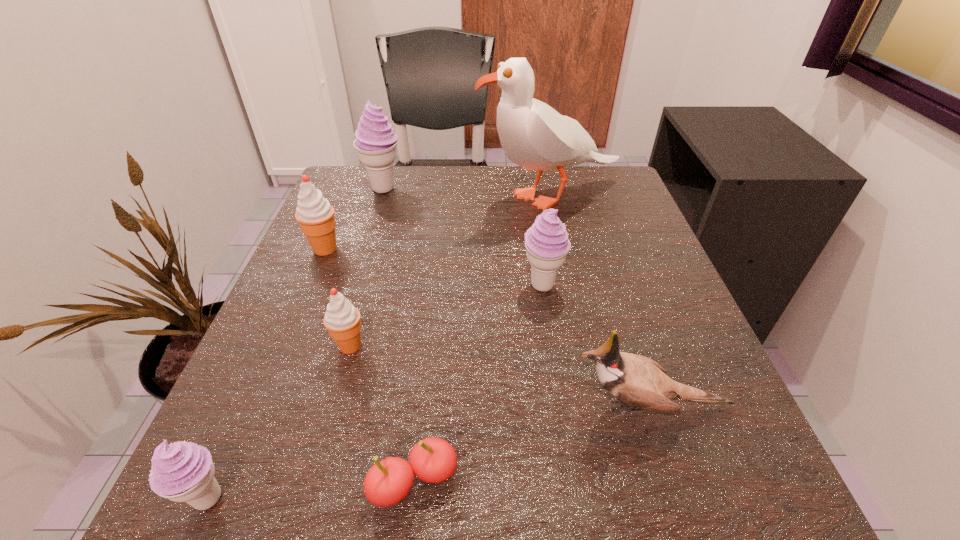
Identify the location of vacant space positioned at the face of the third nearest object. The height and width of the screenshot is (540, 960). (394, 407).

I want to click on free space located at the face of the third nearest object, so click(x=317, y=407).

Locate an element on the screen. The width and height of the screenshot is (960, 540). vacant space located at the face of the third nearest object is located at coordinates (288, 407).

Identify the location of vacant space located on the back of the smaller red icecream. (380, 238).

I want to click on vacant space located 0.270m on the right of the leftmost purple icecream, so click(457, 498).

Locate an element on the screen. Image resolution: width=960 pixels, height=540 pixels. vacant space located on the right of the red cherry is located at coordinates (699, 482).

The width and height of the screenshot is (960, 540). What are the coordinates of `gull that is positioned at the far edge` in the screenshot? It's located at tap(533, 135).

Identify the location of icecream that is at the far edge. (376, 142).

What are the coordinates of `icecream situated at the near edge` in the screenshot? It's located at (182, 471).

Identify the location of cherry at the near edge. This screenshot has width=960, height=540. (433, 460).